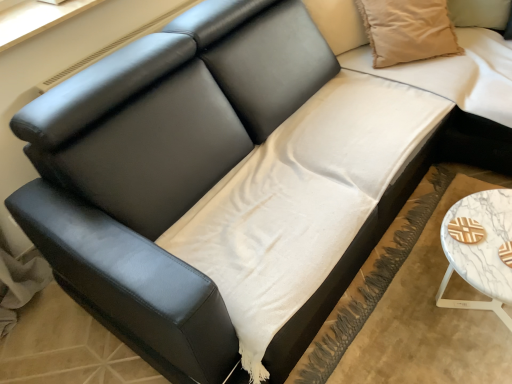
Question: Considering the relative sizes of white marble table at lower right and beige cotton pillow at upper right in the image provided, is white marble table at lower right smaller than beige cotton pillow at upper right?

Choices:
 (A) yes
 (B) no

Answer: (B)

Question: Is white marble table at lower right not close to beige cotton pillow at upper right?

Choices:
 (A) no
 (B) yes

Answer: (A)

Question: From the image's perspective, would you say white marble table at lower right is shown under beige cotton pillow at upper right?

Choices:
 (A) no
 (B) yes

Answer: (B)

Question: Does white marble table at lower right have a greater height compared to beige cotton pillow at upper right?

Choices:
 (A) no
 (B) yes

Answer: (A)

Question: Is white marble table at lower right to the right of beige cotton pillow at upper right from the viewer's perspective?

Choices:
 (A) yes
 (B) no

Answer: (A)

Question: Is point (495, 233) closer or farther from the camera than point (381, 6)?

Choices:
 (A) farther
 (B) closer

Answer: (B)

Question: Visually, is white marble table at lower right positioned to the left or to the right of beige cotton pillow at upper right?

Choices:
 (A) right
 (B) left

Answer: (A)

Question: In terms of size, does white marble table at lower right appear bigger or smaller than beige cotton pillow at upper right?

Choices:
 (A) small
 (B) big

Answer: (B)

Question: From the image's perspective, is white marble table at lower right positioned above or below beige cotton pillow at upper right?

Choices:
 (A) above
 (B) below

Answer: (B)

Question: In the image, is beige cotton pillow at upper right on the left side or the right side of white cotton sheet at center?

Choices:
 (A) left
 (B) right

Answer: (B)

Question: Looking at the image, does beige cotton pillow at upper right seem bigger or smaller compared to white cotton sheet at center?

Choices:
 (A) big
 (B) small

Answer: (B)

Question: Is beige cotton pillow at upper right wider or thinner than white cotton sheet at center?

Choices:
 (A) thin
 (B) wide

Answer: (A)

Question: From a real-world perspective, relative to white cotton sheet at center, is beige cotton pillow at upper right vertically above or below?

Choices:
 (A) below
 (B) above

Answer: (B)

Question: Is white marble table at lower right in front of or behind white cotton sheet at center in the image?

Choices:
 (A) front
 (B) behind

Answer: (B)

Question: Is white marble table at lower right taller or shorter than white cotton sheet at center?

Choices:
 (A) short
 (B) tall

Answer: (B)